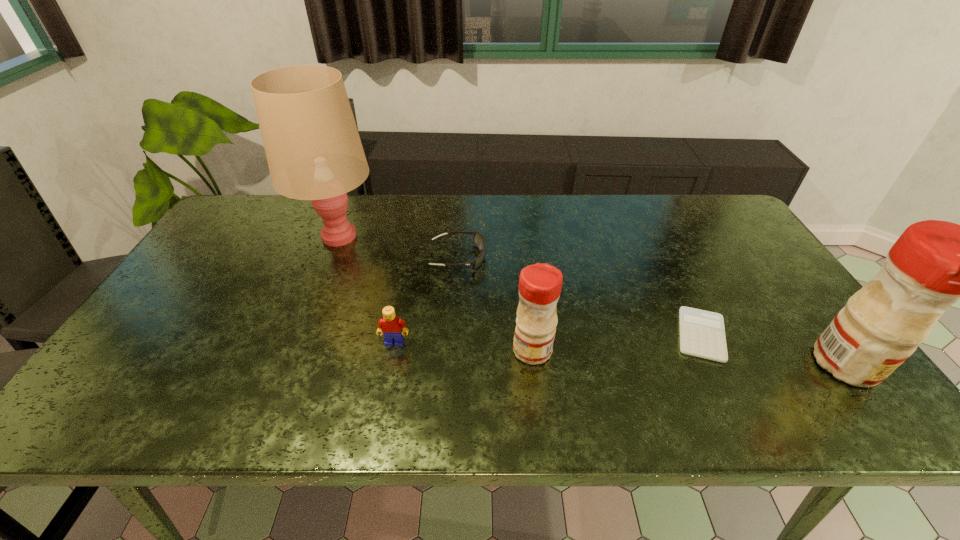
This screenshot has width=960, height=540. What are the coordinates of `the left condiment` in the screenshot? It's located at (540, 285).

Image resolution: width=960 pixels, height=540 pixels. I want to click on the third tallest object, so click(540, 285).

You are a GUI agent. You are given a task and a screenshot of the screen. Output one action in this format:
    pyautogui.click(x=<x>, y=<y>)
    Task: Click on the right condiment
    
    Given the screenshot: What is the action you would take?
    pos(933,264)

The width and height of the screenshot is (960, 540). Identify the location of the fifth shortest object. (933, 264).

You are a GUI agent. You are given a task and a screenshot of the screen. Output one action in this format:
    pyautogui.click(x=<x>, y=<y>)
    Task: Click on the second shortest object
    Image resolution: width=960 pixels, height=540 pixels.
    Given the screenshot: What is the action you would take?
    pyautogui.click(x=479, y=240)

Identify the location of goggles. (479, 240).

You are a GUI agent. You are given a task and a screenshot of the screen. Output one action in this format:
    pyautogui.click(x=<x>, y=<y>)
    Task: Click on the leftmost object
    This screenshot has width=960, height=540.
    Given the screenshot: What is the action you would take?
    pyautogui.click(x=314, y=152)

This screenshot has width=960, height=540. Find the location of `lampshade`. lampshade is located at coordinates (314, 152).

Find the location of a particular element. The height and width of the screenshot is (540, 960). the second object from left to right is located at coordinates (390, 326).

The image size is (960, 540). Identify the location of the third shortest object. (390, 326).